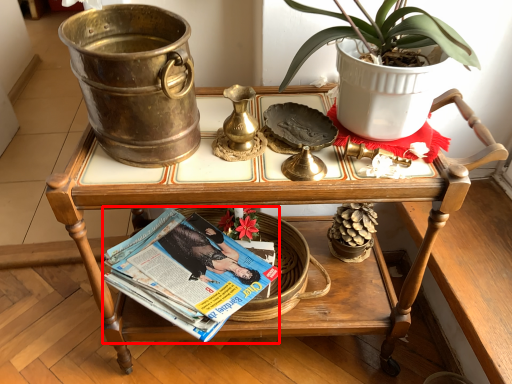
Question: From the image's perspective, where is magazine (annotated by the red box) located in relation to table in the image?

Choices:
 (A) above
 (B) below

Answer: (B)